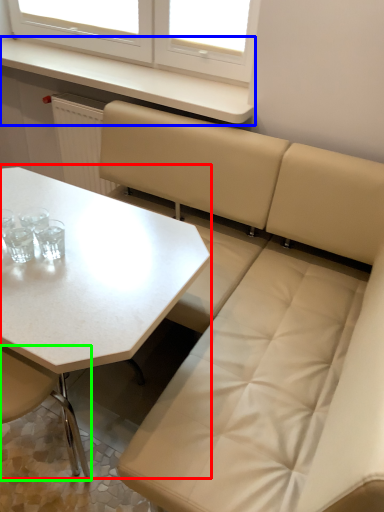
Question: Which is nearer to the table (highlighted by a red box)? counter top (highlighted by a blue box) or chair (highlighted by a green box).

Choices:
 (A) counter top
 (B) chair

Answer: (B)